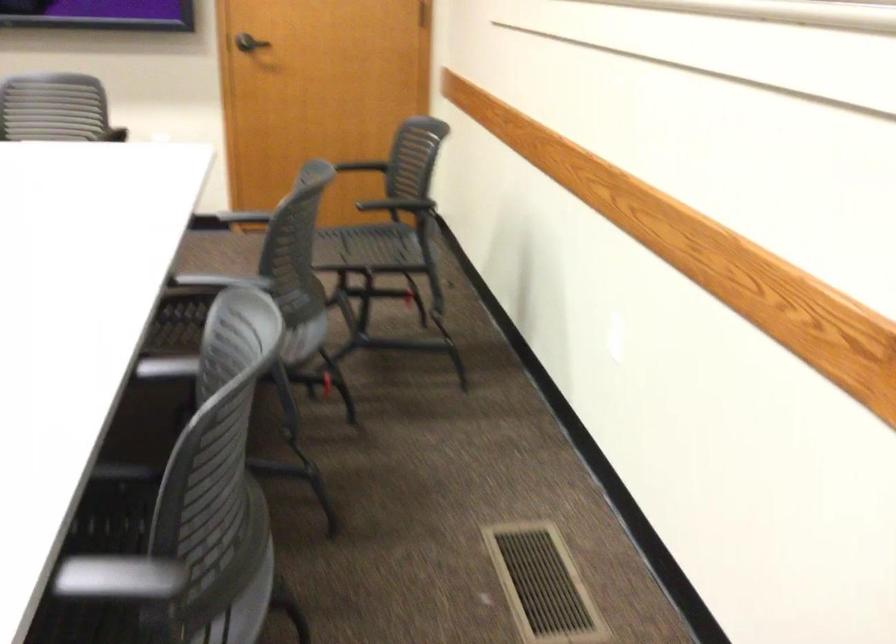
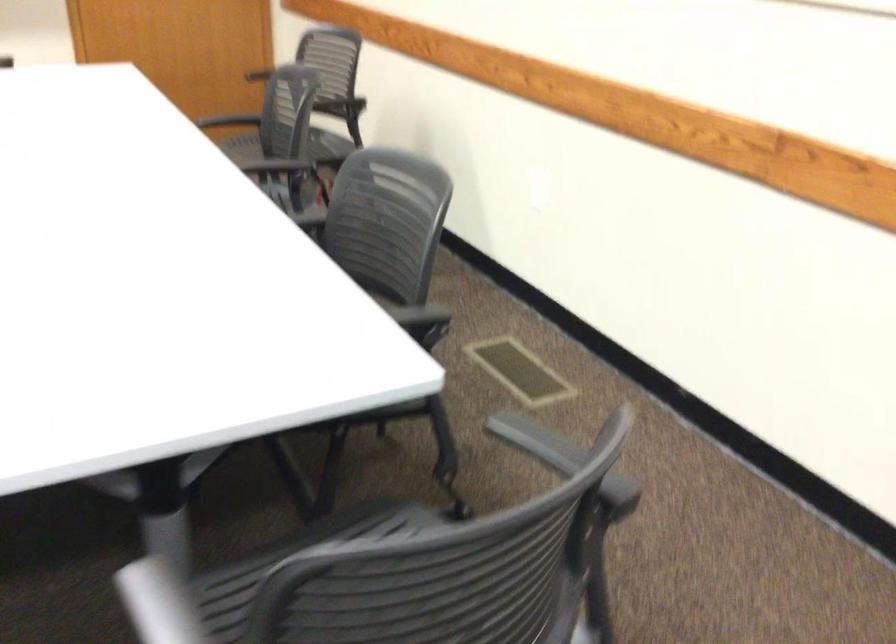
Question: Based on the continuous images, in which direction is the camera rotating? Reply with the corresponding letter.

Choices:
 (A) Left
 (B) Right
 (C) Up
 (D) Down

Answer: (B)